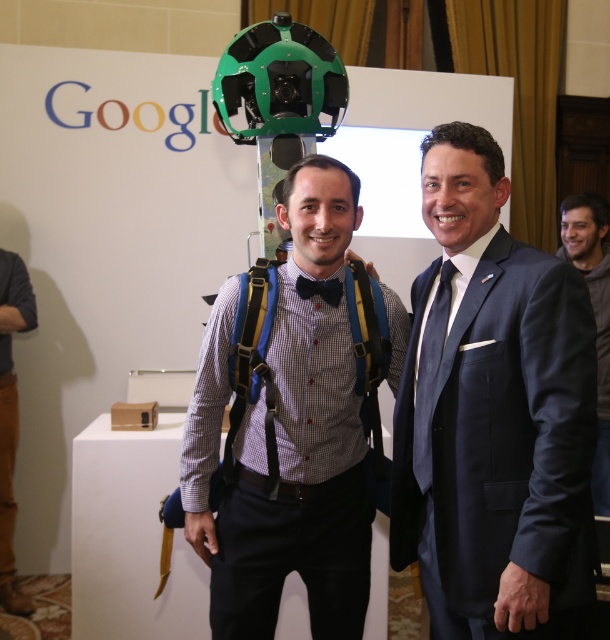
Between navy blue suit at center and dark gray textured jacket at center, which one has less height?

Standing shorter between the two is navy blue suit at center.

Which is behind, point (439, 515) or point (580, 248)?

The point (580, 248) is more distant.

Which is in front, point (533, 412) or point (564, 236)?

Point (533, 412)

Identify the location of navy blue suit at center. The width and height of the screenshot is (610, 640). (493, 413).

This screenshot has height=640, width=610. What do you see at coordinates (253, 362) in the screenshot?
I see `blue fabric suspenders at center` at bounding box center [253, 362].

Between blue fabric suspenders at center and black satin bow tie at center, which one has more height?

blue fabric suspenders at center

What do you see at coordinates (253, 362) in the screenshot? I see `blue fabric suspenders at center` at bounding box center [253, 362].

The width and height of the screenshot is (610, 640). What are the coordinates of `blue fabric suspenders at center` in the screenshot? It's located at (253, 362).

In the scene shown: Which of these two, blue fabric suspenders at center or brown leather pants at lower left, stands shorter?

blue fabric suspenders at center

What do you see at coordinates (253, 362) in the screenshot? I see `blue fabric suspenders at center` at bounding box center [253, 362].

Where is `blue fabric suspenders at center`? This screenshot has height=640, width=610. blue fabric suspenders at center is located at coordinates (253, 362).